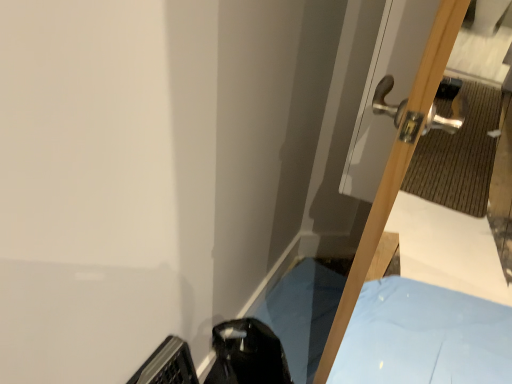
Locate an element on the screen. The height and width of the screenshot is (384, 512). free point to the right of metallic silver door at upper right is located at coordinates (417, 328).